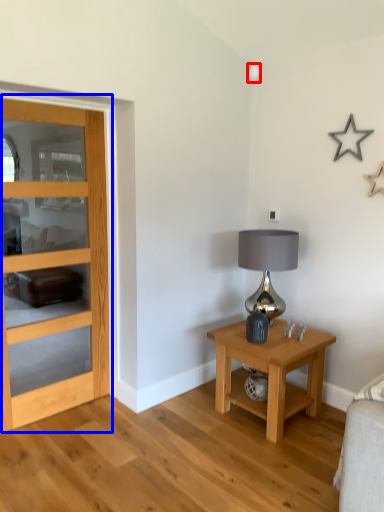
Question: Which point is closer to the camera, lamp (highlighted by a red box) or door (highlighted by a blue box)?

Choices:
 (A) lamp
 (B) door

Answer: (B)